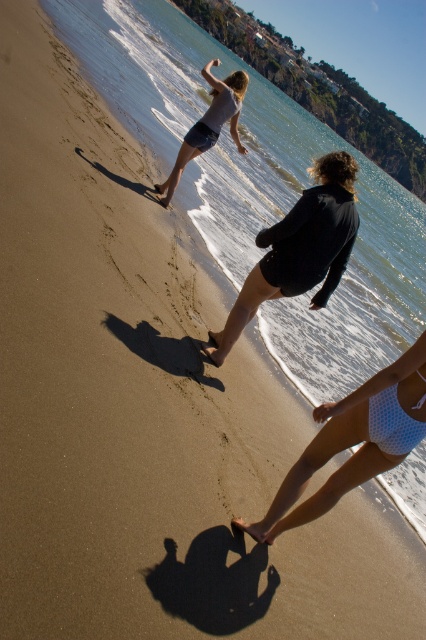
Question: Which of the following is the closest to the observer?

Choices:
 (A) (187, 132)
 (B) (379, 392)
 (C) (385, 388)

Answer: (B)

Question: Is matte gray shorts at upper center below white mesh bikini top at lower right?

Choices:
 (A) yes
 (B) no

Answer: (B)

Question: Can you confirm if matte gray shorts at upper center is positioned below white mesh bikini top at lower right?

Choices:
 (A) yes
 (B) no

Answer: (B)

Question: Which point is closer to the camera?

Choices:
 (A) white mesh bikini top at lower right
 (B) black matte shorts at center
 (C) matte gray shorts at upper center
 (D) white polka dot swimsuit at lower center

Answer: (D)

Question: From the image, what is the correct spatial relationship of black matte shorts at center in relation to white mesh bikini top at lower right?

Choices:
 (A) below
 (B) above

Answer: (B)

Question: Which point is closer to the camera?

Choices:
 (A) white mesh bikini top at lower right
 (B) black matte shorts at center

Answer: (A)